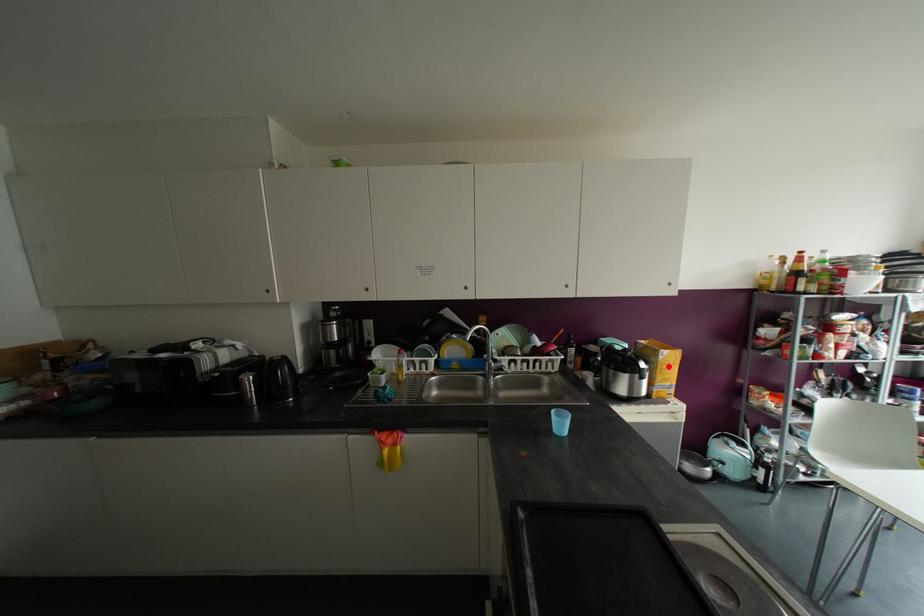
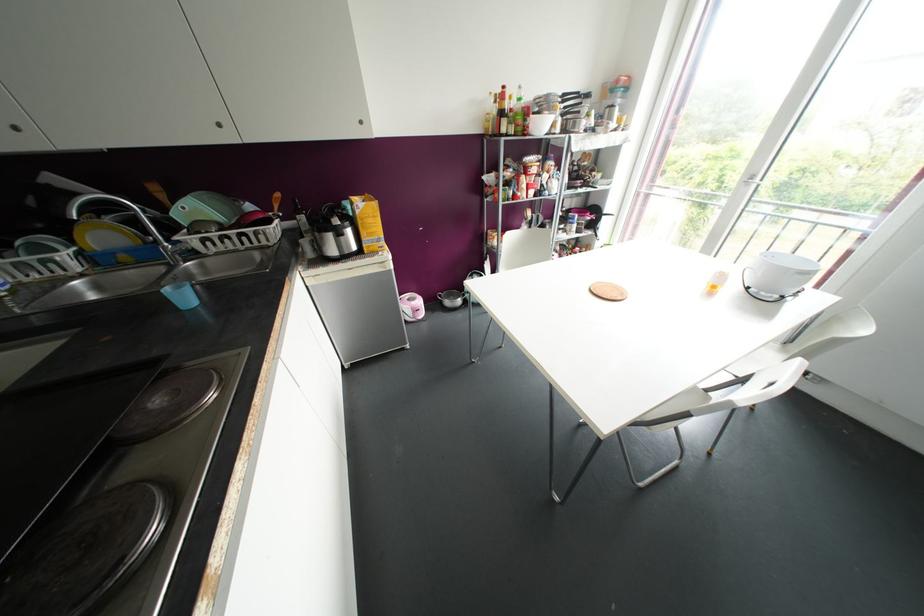
Question: I am providing you with two images of the same scene from different viewpoints. Image1 has a red point marked. In image2, the corresponding 3D location appears at what relative position? Reply with the corresponding letter.

Choices:
 (A) Closer
 (B) Farther

Answer: (A)